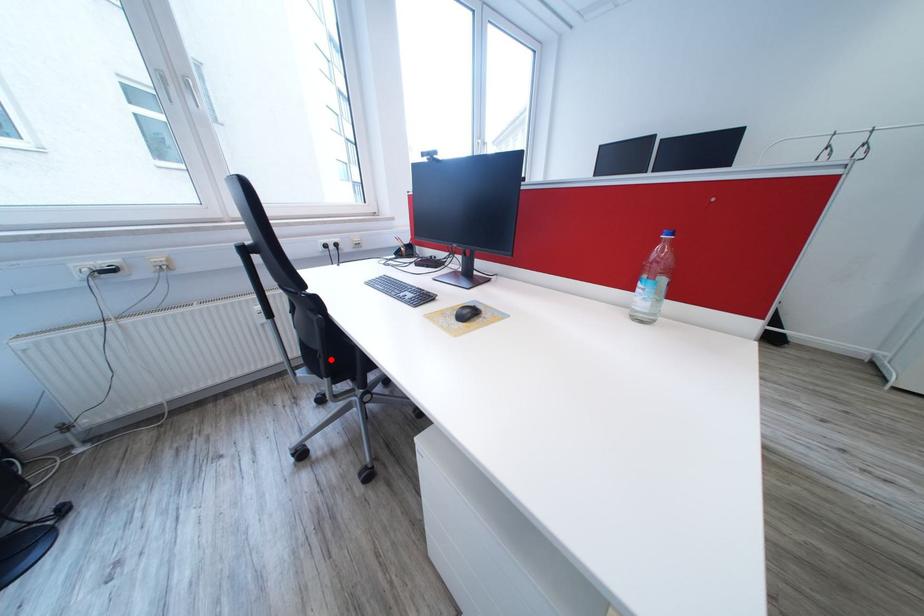
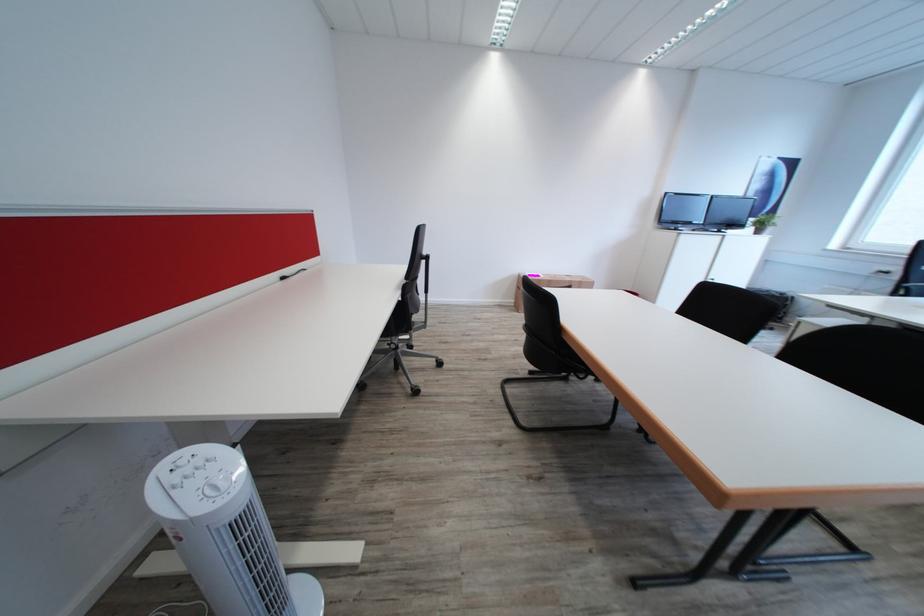
Question: I am providing you with two images of the same scene from different viewpoints. A red point is marked on the first image. Can you still see the location of the red point in image 2?

Choices:
 (A) Yes
 (B) No

Answer: (B)